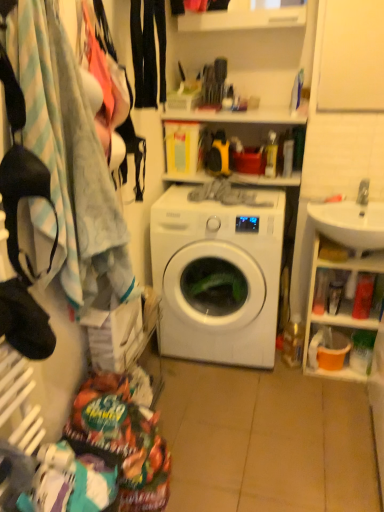
At what (x,y) coordinates should I click in order to perform the action: click on unoccupied area in front of white glossy cabinet at right. Please return your answer as a coordinate pair (x, y). The width and height of the screenshot is (384, 512). Looking at the image, I should click on (343, 398).